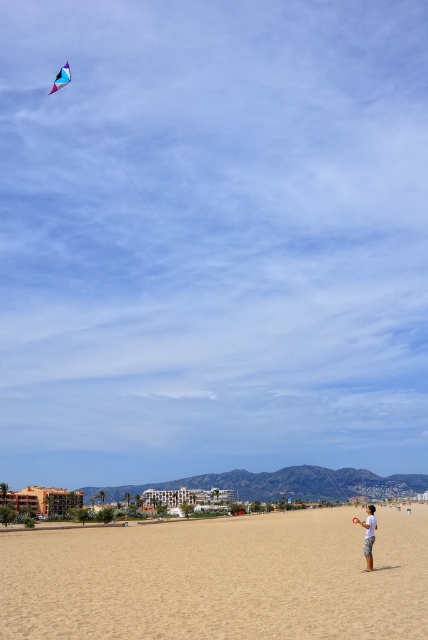
Consider the image. You are standing on the beach and see the light blue cotton shorts at lower right and the translucent blue kite at upper left. Which object is closer to you?

The light blue cotton shorts at lower right is positioned under the translucent blue kite at upper left, meaning it is closer to you.